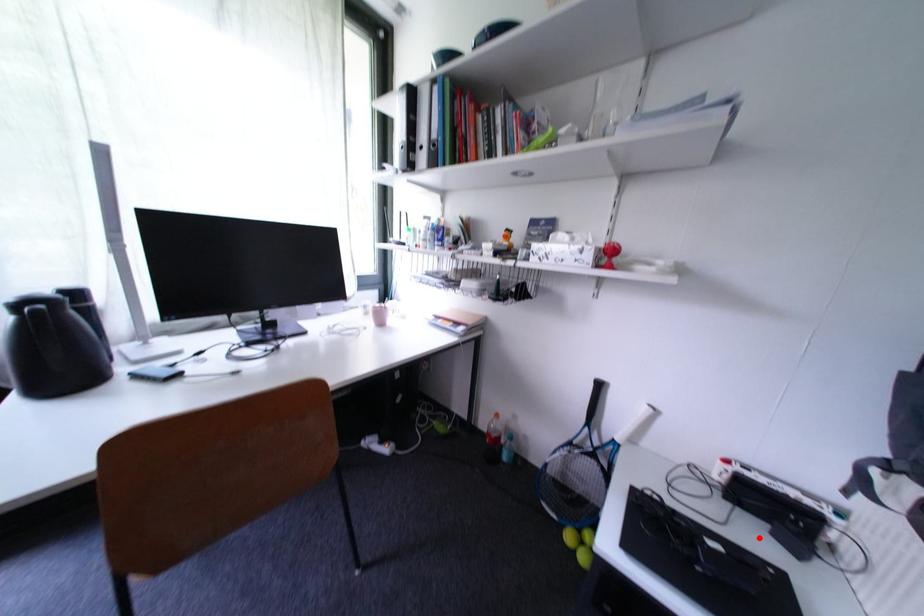
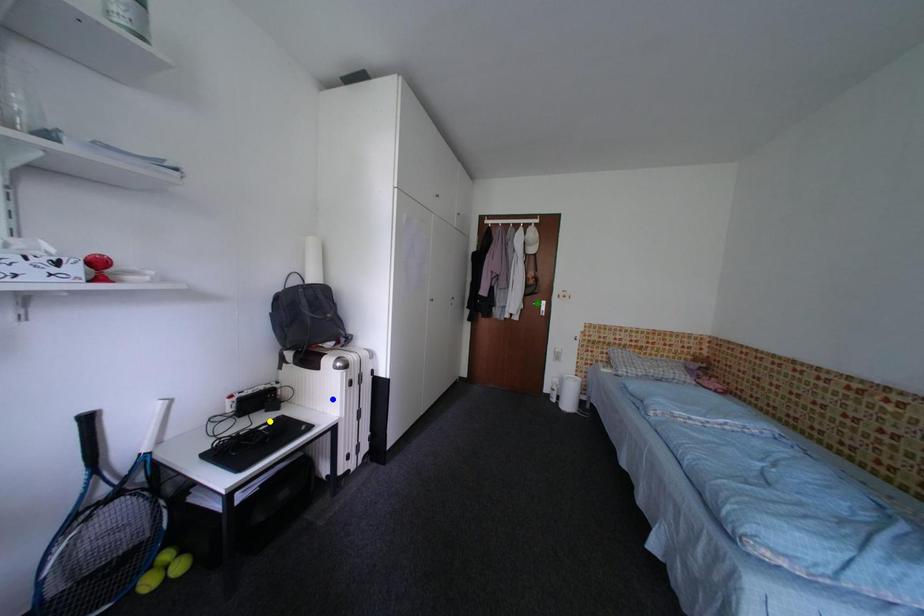
Question: I am providing you with two images of the same scene from different viewpoints. A red point is marked on the first image. You are given multiple points on the second image. Which point in image 2 is actually the same real-world point as the red point in image 1?

Choices:
 (A) green point
 (B) blue point
 (C) yellow point

Answer: (C)